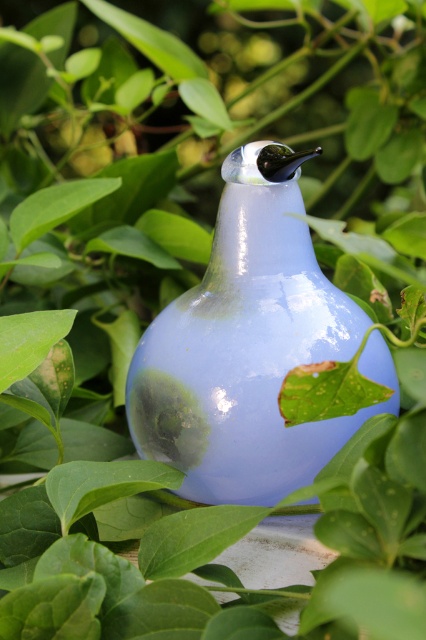
You are an interior designer arranging plants around the light blue vase. You have two leaves to place on the table next to the vase. The green glossy leaf at upper left and the green matte leaf at lower left. Which leaf has a bigger surface area?

The green glossy leaf at upper left has a larger surface area than the green matte leaf at lower left.

You are taking a photo of the light blue bulbous vase with a narrow neck and a small dark spout. You notice two points marked as point 1 at coordinates (48, 218) and point 2 at (51, 314). Which point is closer to the camera?

Point 1 at coordinates (48, 218) is closer to the camera than point 2 at (51, 314).

You are an interior designer arranging plants around the light blue vase. You have two green glossy leaves to place. The green glossy leaf at lower left and the green glossy leaf at upper left. Which leaf is wider?

The green glossy leaf at upper left is wider than the green glossy leaf at lower left.